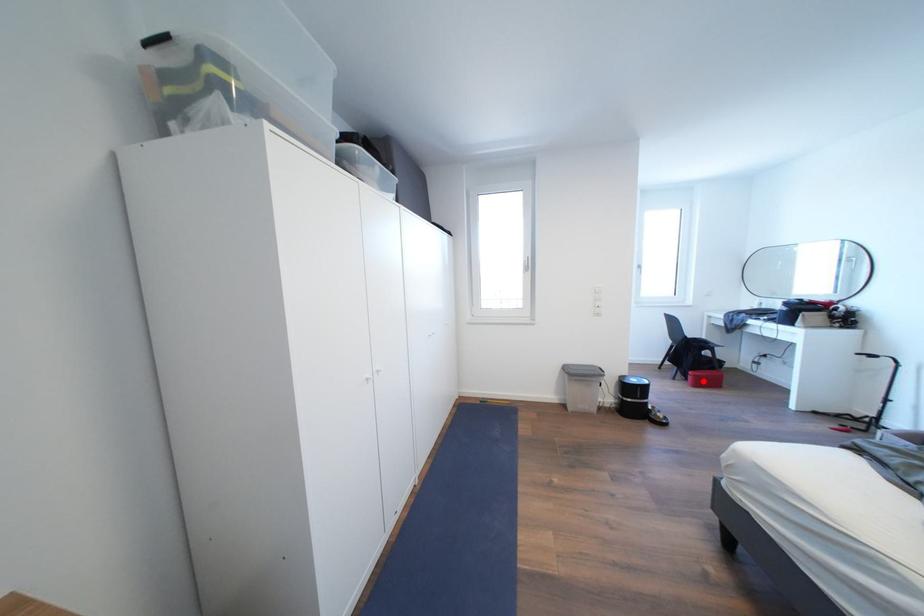
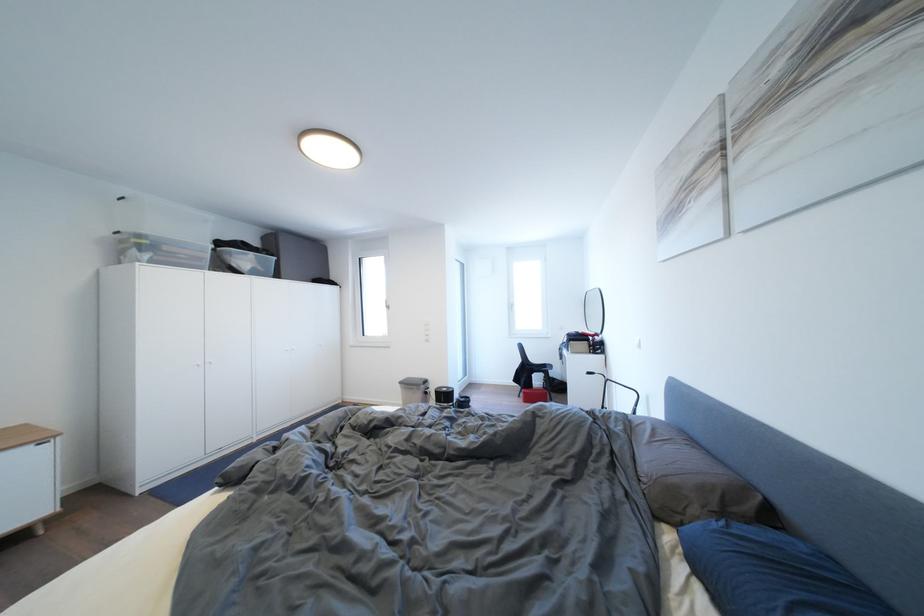
Question: I am providing you with two images of the same scene from different viewpoints. In image1, a red point is highlighted. Considering the same 3D point in image2, which of the following is correct?

Choices:
 (A) It is closer
 (B) It is farther

Answer: (B)